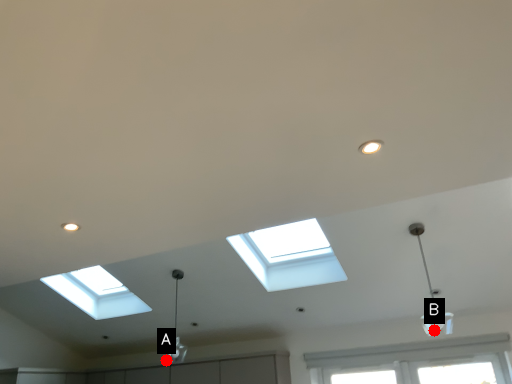
Question: Two points are circled on the image, labeled by A and B beside each circle. Among these points, which one is nearest to the camera?

Choices:
 (A) A is closer
 (B) B is closer

Answer: (B)